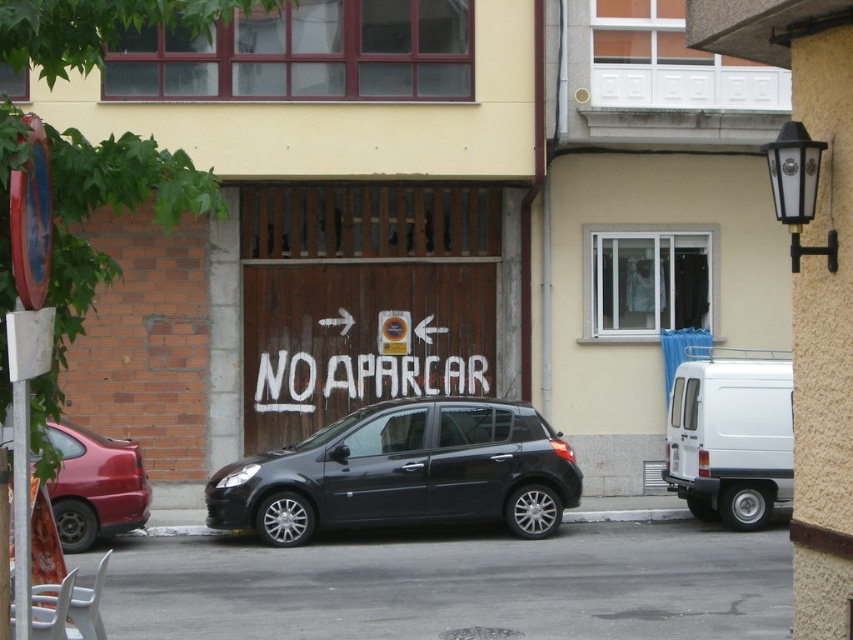
Question: Does white matte van at right appear over metallic red car at left?

Choices:
 (A) yes
 (B) no

Answer: (A)

Question: Which point is farther from the camera taking this photo?

Choices:
 (A) (677, 481)
 (B) (83, 460)

Answer: (A)

Question: Can you confirm if black metallic car at center is positioned to the left of metallic red car at left?

Choices:
 (A) yes
 (B) no

Answer: (B)

Question: Which of the following is the farthest from the observer?

Choices:
 (A) white matte van at right
 (B) metallic red car at left
 (C) black metallic car at center

Answer: (A)

Question: Which point appears farthest from the camera in this image?

Choices:
 (A) (689, 464)
 (B) (428, 445)
 (C) (67, 481)

Answer: (A)

Question: Can you confirm if black metallic car at center is positioned below white matte van at right?

Choices:
 (A) yes
 (B) no

Answer: (A)